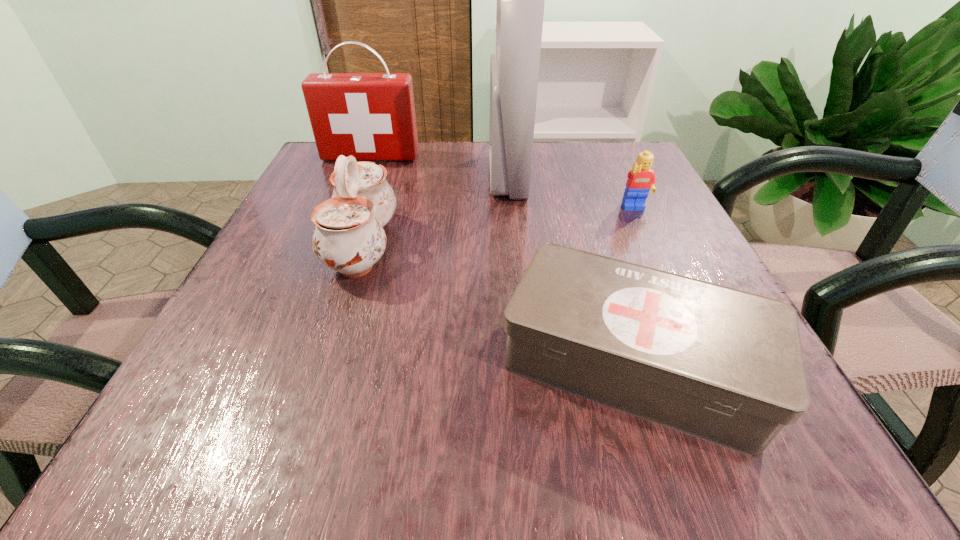
The image size is (960, 540). What are the coordinates of `vacant area that satisfies the following two spatial constraints: 1. by the handle of the third tallest object; 2. on the back side of the nearest first-aid kit` in the screenshot? It's located at pos(325,363).

You are a GUI agent. You are given a task and a screenshot of the screen. Output one action in this format:
    pyautogui.click(x=<x>, y=<y>)
    Task: Click on the vacant space that satisfies the following two spatial constraints: 1. by the handle of the chinaware; 2. on the left side of the nearest object
    
    Given the screenshot: What is the action you would take?
    pyautogui.click(x=325, y=363)

Locate an element on the screen. The height and width of the screenshot is (540, 960). free space that satisfies the following two spatial constraints: 1. by the handle of the chinaware; 2. on the back side of the nearest object is located at coordinates (325, 363).

Find the location of a particular element. This screenshot has width=960, height=540. free space that satisfies the following two spatial constraints: 1. on the front-facing side of the tallest object; 2. on the left side of the shortest first-aid kit is located at coordinates (524, 363).